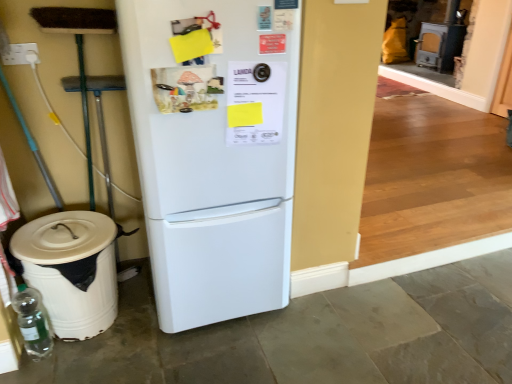
Question: Is white matte refrigerator at center inside or outside of transparent glass bottle at lower left?

Choices:
 (A) inside
 (B) outside

Answer: (B)

Question: Is white matte refrigerator at center in front of or behind transparent glass bottle at lower left in the image?

Choices:
 (A) front
 (B) behind

Answer: (A)

Question: Considering the real-world distances, which object is farthest from the white matte refrigerator at center?

Choices:
 (A) transparent glass bottle at lower left
 (B) white plastic trash bin at lower left

Answer: (A)

Question: Estimate the real-world distances between objects in this image. Which object is farther from the transparent glass bottle at lower left?

Choices:
 (A) white plastic trash bin at lower left
 (B) white matte refrigerator at center

Answer: (B)